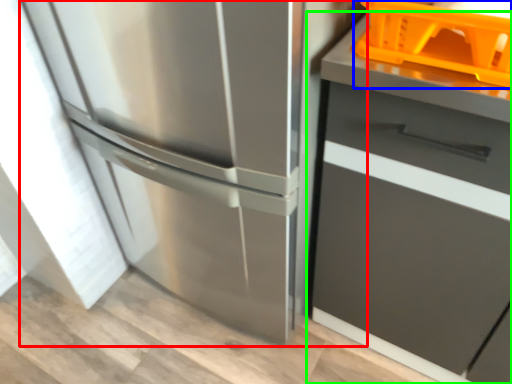
Question: Which object is the farthest from refrigerator (highlighted by a red box)? Choose among these: basket (highlighted by a blue box) or cabinetry (highlighted by a green box).

Choices:
 (A) basket
 (B) cabinetry

Answer: (A)